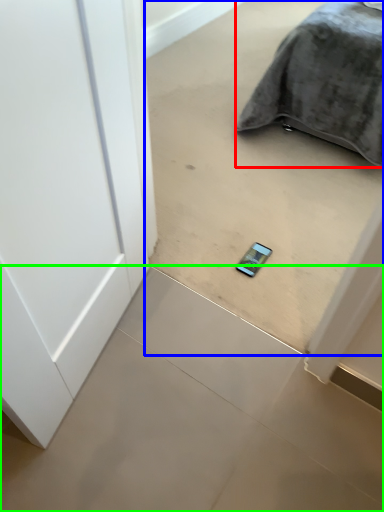
Question: Based on their relative distances, which object is farther from furniture (highlighted by a red box)? Choose from concrete (highlighted by a blue box) and concrete (highlighted by a green box).

Choices:
 (A) concrete
 (B) concrete

Answer: (B)